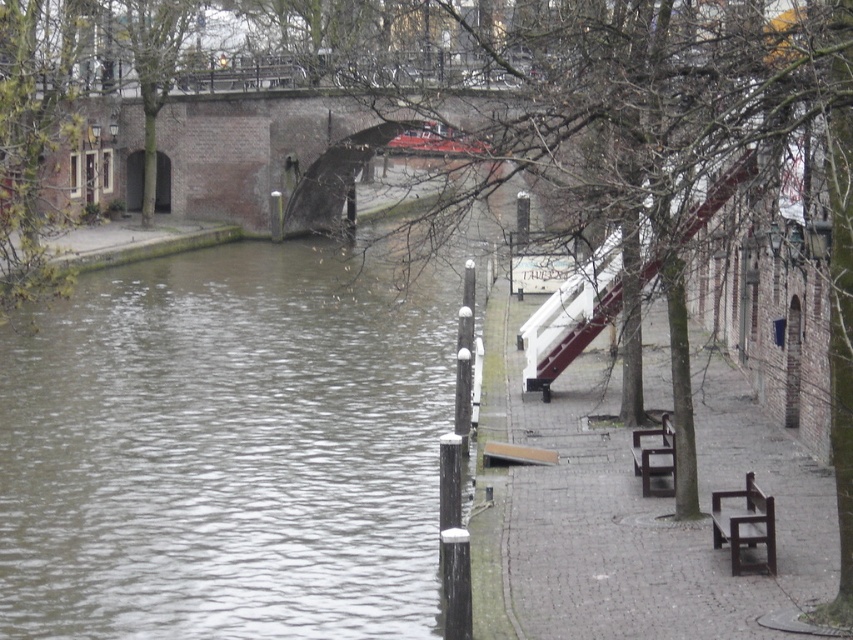
You are a tourist visiting the canal and want to sit down to enjoy the view. You see a dark brown wooden bench at lower right and a brown wooden bench at lower center. Which bench would you choose if you prefer a larger seating area?

The brown wooden bench at lower center is larger in size compared to the dark brown wooden bench at lower right, so you should choose the brown wooden bench at lower center for a larger seating area.

You are a tourist visiting the canal and want to sit down to enjoy the view. The white painted wood rail at center right and the dark brown wooden bench at lower right are both nearby. Which one is larger in size?

The white painted wood rail at center right is bigger than the dark brown wooden bench at lower right, so the rail is larger in size.

You are a tourist standing on the paved walkway on the right bank of the canal. You see the dark brown wooden bench at lower right and the brown wooden bench at lower center. Which bench is closer to the water?

The dark brown wooden bench at lower right is closer to the water because it is positioned below the brown wooden bench at lower center, meaning it is lower in elevation and nearer to the water level.